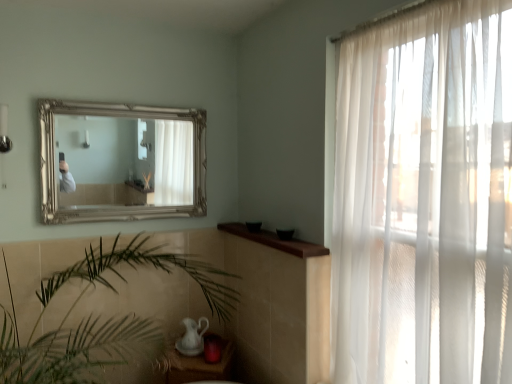
I want to click on vacant space situated above matte white table at lower center (from a real-world perspective), so click(199, 358).